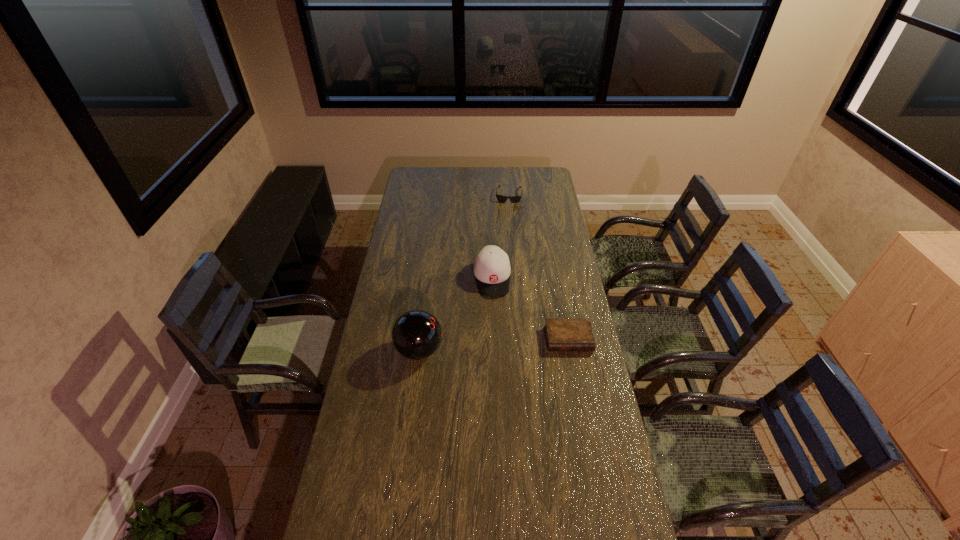
Where is `free region at the near right corner`? free region at the near right corner is located at coordinates (586, 512).

I want to click on vacant space in between the bowling ball and the baseball cap, so click(x=456, y=314).

At what (x,y) coordinates should I click in order to perform the action: click on free spot between the sunglasses and the diary. Please return your answer as a coordinate pair (x, y). Looking at the image, I should click on (539, 267).

The height and width of the screenshot is (540, 960). Find the location of `unoccupied area between the leftmost object and the sunglasses`. unoccupied area between the leftmost object and the sunglasses is located at coordinates pyautogui.click(x=464, y=273).

This screenshot has width=960, height=540. I want to click on unoccupied area between the second tallest object and the tallest object, so click(456, 314).

Locate an element on the screen. The height and width of the screenshot is (540, 960). vacant region between the third nearest object and the sunglasses is located at coordinates (500, 237).

At what (x,y) coordinates should I click in order to perform the action: click on free spot between the bowling ball and the sunglasses. Please return your answer as a coordinate pair (x, y). The width and height of the screenshot is (960, 540). Looking at the image, I should click on (464, 273).

Identify the location of empty space that is in between the second tallest object and the tallest object. tap(456, 314).

Where is `vacant area between the rightmost object and the leftmost object`? The height and width of the screenshot is (540, 960). vacant area between the rightmost object and the leftmost object is located at coordinates (494, 345).

This screenshot has width=960, height=540. I want to click on free space between the baseball cap and the sunglasses, so click(x=500, y=237).